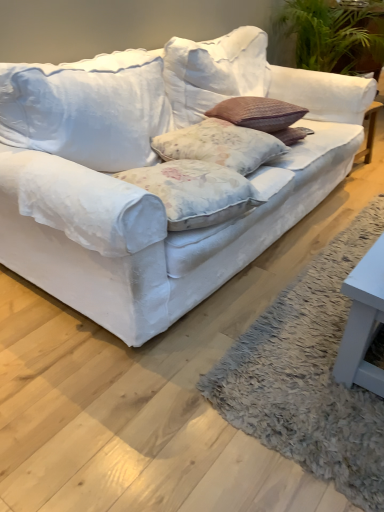
Question: From the image's perspective, is white fabric couch at center located above floral fabric pillow at center?

Choices:
 (A) yes
 (B) no

Answer: (A)

Question: Considering the relative sizes of white fabric couch at center and floral fabric pillow at center in the image provided, is white fabric couch at center thinner than floral fabric pillow at center?

Choices:
 (A) no
 (B) yes

Answer: (A)

Question: Is there a large distance between white fabric couch at center and floral fabric pillow at center?

Choices:
 (A) yes
 (B) no

Answer: (B)

Question: Can you confirm if white fabric couch at center is bigger than floral fabric pillow at center?

Choices:
 (A) no
 (B) yes

Answer: (B)

Question: Is white fabric couch at center not within floral fabric pillow at center?

Choices:
 (A) no
 (B) yes

Answer: (B)

Question: From the image's perspective, is white fabric couch at center below floral fabric pillow at center?

Choices:
 (A) no
 (B) yes

Answer: (A)

Question: Can you confirm if floral fabric pillow at center is wider than white fabric couch at center?

Choices:
 (A) no
 (B) yes

Answer: (A)

Question: Considering the relative positions of floral fabric pillow at center and white fabric couch at center in the image provided, is floral fabric pillow at center to the left of white fabric couch at center from the viewer's perspective?

Choices:
 (A) yes
 (B) no

Answer: (B)

Question: From the image's perspective, is floral fabric pillow at center below white fabric couch at center?

Choices:
 (A) no
 (B) yes

Answer: (B)

Question: Considering the relative sizes of floral fabric pillow at center and white fabric couch at center in the image provided, is floral fabric pillow at center shorter than white fabric couch at center?

Choices:
 (A) no
 (B) yes

Answer: (B)

Question: Would you consider floral fabric pillow at center to be distant from white fabric couch at center?

Choices:
 (A) yes
 (B) no

Answer: (B)

Question: Is floral fabric pillow at center positioned before white fabric couch at center?

Choices:
 (A) no
 (B) yes

Answer: (A)

Question: From the image's perspective, is floral fabric pillow at center above or below white fabric couch at center?

Choices:
 (A) above
 (B) below

Answer: (B)